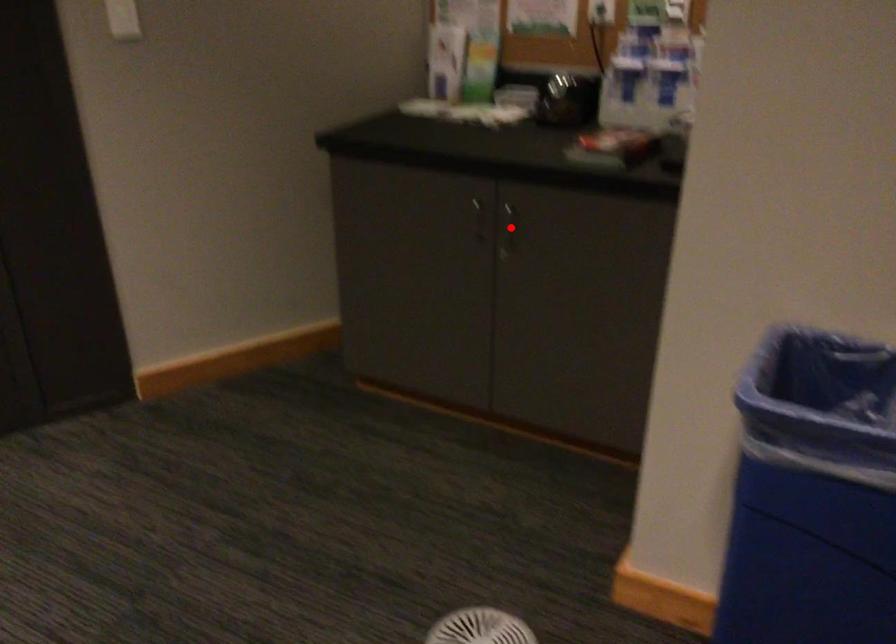
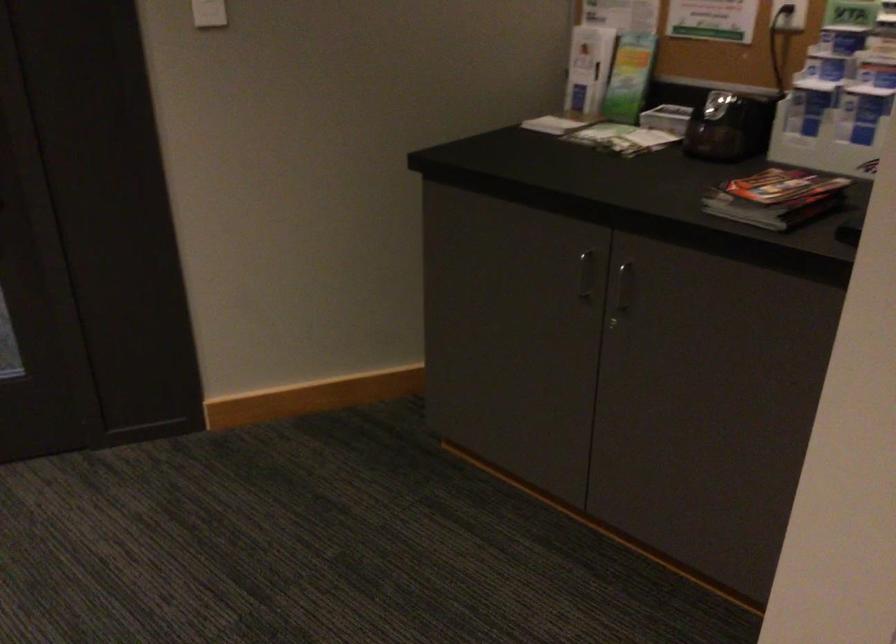
Question: I am providing you with two images of the same scene from different viewpoints. In image1, a red point is highlighted. Considering the same 3D point in image2, which of the following is correct?

Choices:
 (A) It is closer
 (B) It is farther

Answer: (A)